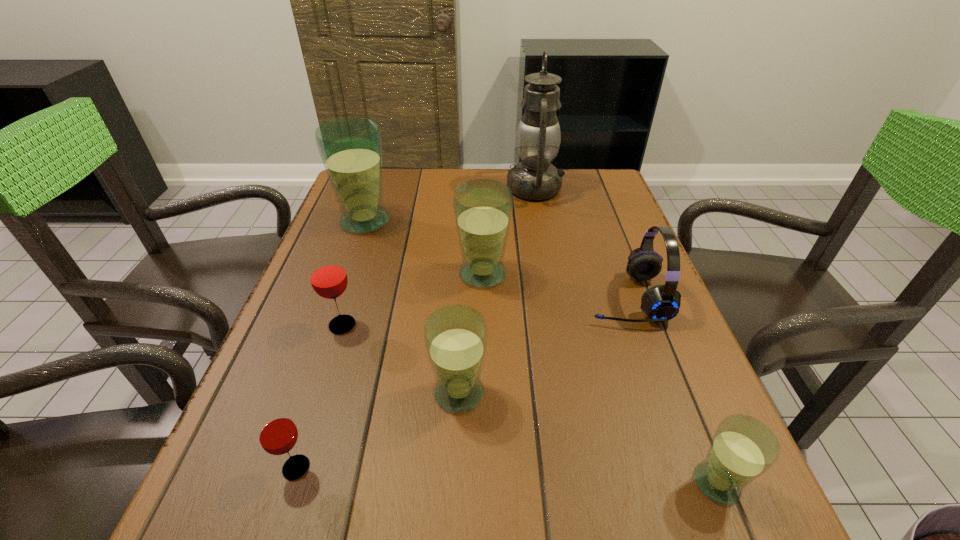
I want to click on the smaller red glass, so click(277, 433).

Find the location of a particular element. The image size is (960, 540). the nearest blue glass is located at coordinates (743, 448).

Find the location of `the smallest blue glass`. the smallest blue glass is located at coordinates (743, 448).

Find the location of `free spot located 0.250m on the front of the tallest object`. free spot located 0.250m on the front of the tallest object is located at coordinates (548, 261).

The width and height of the screenshot is (960, 540). What are the coordinates of `vacant region located 0.180m on the back of the farthest blue glass` in the screenshot? It's located at (380, 177).

I want to click on free space located on the left of the second farthest blue glass, so click(334, 274).

Image resolution: width=960 pixels, height=540 pixels. In order to click on vacant space located on the ear cushions of the headset in this screenshot , I will do `click(491, 298)`.

The image size is (960, 540). Identify the location of free space located on the ear cushions of the headset. (412, 298).

Find the location of a particular element. vacant area situated 0.330m on the ear cushions of the headset is located at coordinates (443, 298).

In order to click on free space located on the right of the bigger red glass in this screenshot , I will do `click(502, 325)`.